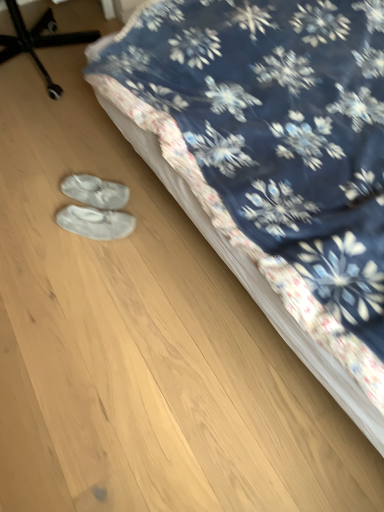
Find the location of `free space behind white suede slippers at lower center, the first footwear from the bottom`. free space behind white suede slippers at lower center, the first footwear from the bottom is located at coordinates pyautogui.click(x=102, y=180).